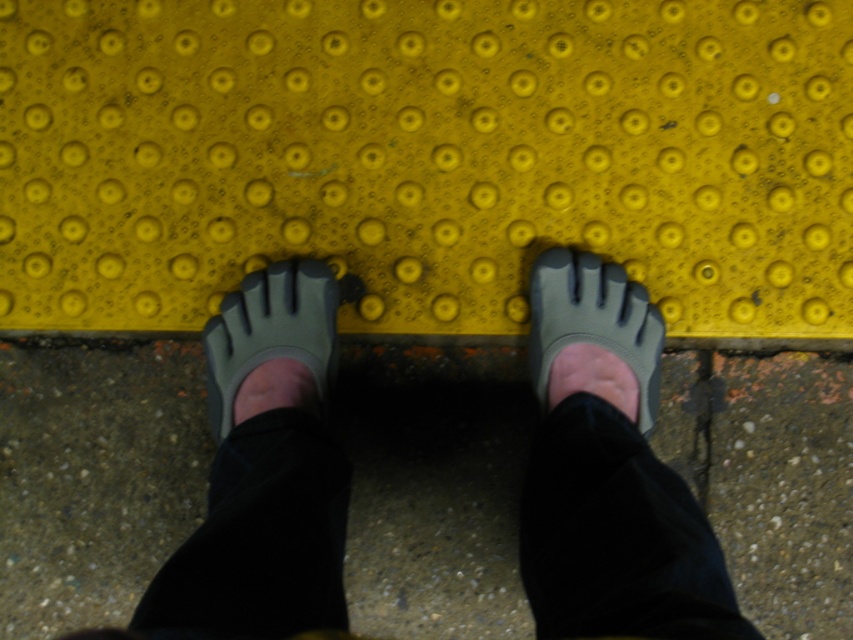
Is point (323, 346) farther from viewer compared to point (140, 339)?

No.

Who is positioned more to the left, gray rubber toe separator at center or yellow rubber curb at center?

gray rubber toe separator at center is more to the left.

Image resolution: width=853 pixels, height=640 pixels. What do you see at coordinates (270, 332) in the screenshot? I see `gray rubber toe separator at center` at bounding box center [270, 332].

Find the location of a particular element. gray rubber toe separator at center is located at coordinates (270, 332).

In the scene shown: Between gray rubber toe separator at center and matte gray toe separator at center, which one has more height?

Standing taller between the two is matte gray toe separator at center.

Which is in front, point (329, 333) or point (556, 320)?

Positioned in front is point (556, 320).

Find the location of a particular element. gray rubber toe separator at center is located at coordinates (270, 332).

Can you confirm if concrete at center is positioned to the right of yellow rubber curb at center?

Incorrect, concrete at center is not on the right side of yellow rubber curb at center.

Is concrete at center bigger than yellow rubber curb at center?

Yes.

Does point (410, 524) lie in front of point (782, 349)?

Yes, point (410, 524) is in front of point (782, 349).

Where is `concrete at center`? concrete at center is located at coordinates pos(94,474).